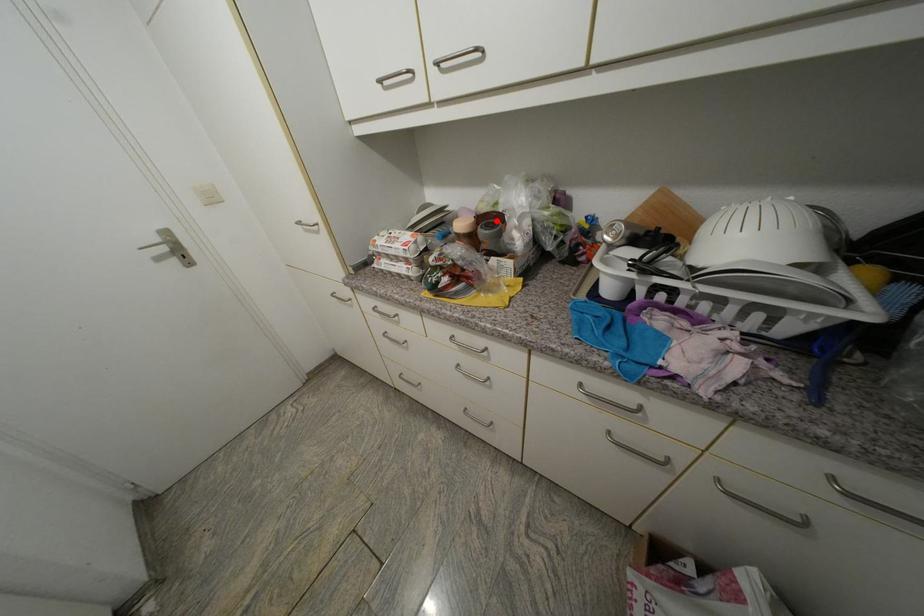
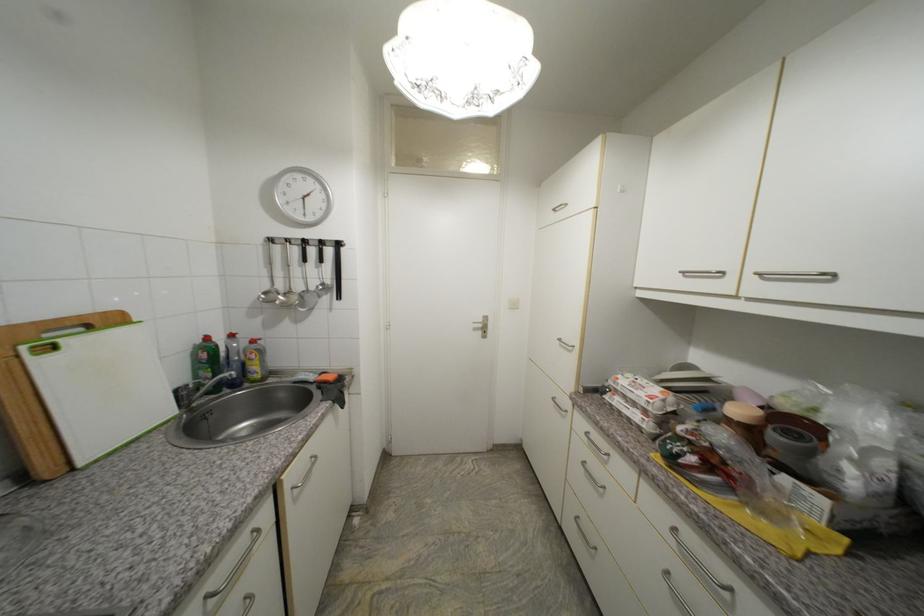
Find the pixel in the second image that matches the highlighted location in the first image.

(803, 428)